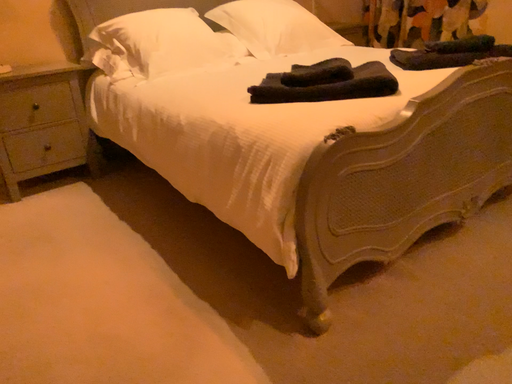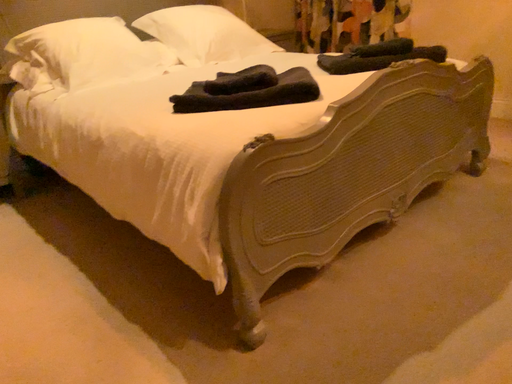
Question: How did the camera likely rotate when shooting the video?

Choices:
 (A) rotated right
 (B) rotated left

Answer: (A)